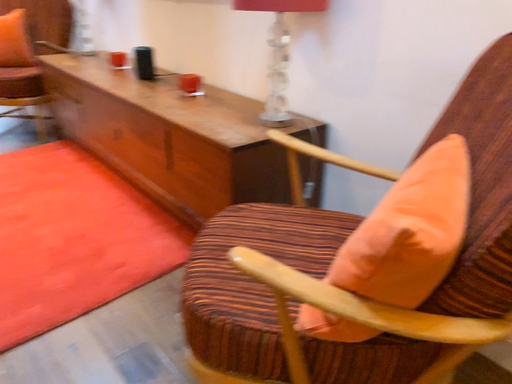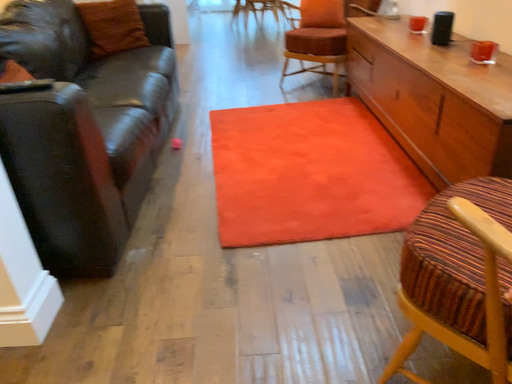
Question: Which way did the camera rotate in the video?

Choices:
 (A) rotated right
 (B) rotated left

Answer: (B)